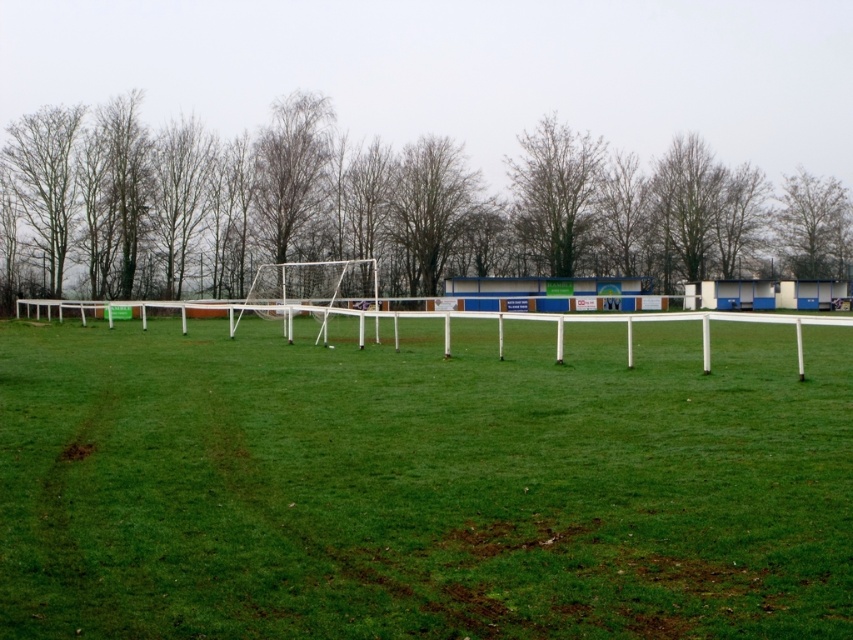
Question: Can you confirm if green grass at center is positioned to the left of bare branches at upper right?

Choices:
 (A) no
 (B) yes

Answer: (B)

Question: Which of the following is the closest to the observer?

Choices:
 (A) bare branches at upper right
 (B) bare branches at center
 (C) brown leafless tree at upper left
 (D) green grass at center

Answer: (D)

Question: Considering the real-world distances, which object is closest to the bare branches at center?

Choices:
 (A) bare branches at upper right
 (B) green grass at center
 (C) brown leafless tree at upper left

Answer: (C)

Question: Does green grass at center appear on the left side of bare branches at upper right?

Choices:
 (A) no
 (B) yes

Answer: (B)

Question: Among these objects, which one is nearest to the camera?

Choices:
 (A) bare branches at center
 (B) green grass at center
 (C) brown leafless tree at upper left

Answer: (B)

Question: Observing the image, what is the correct spatial positioning of brown leafless tree at upper left in reference to bare branches at center?

Choices:
 (A) below
 (B) above

Answer: (A)